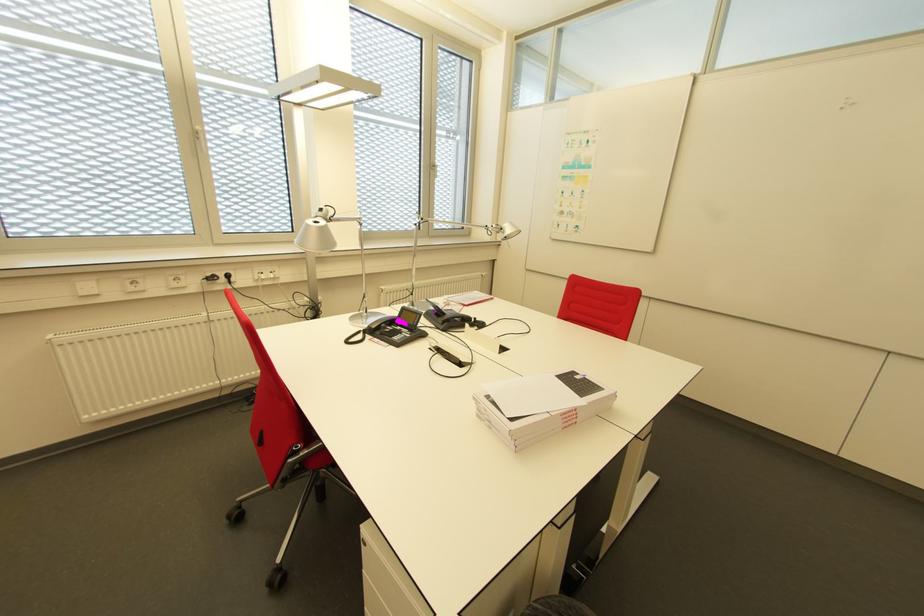
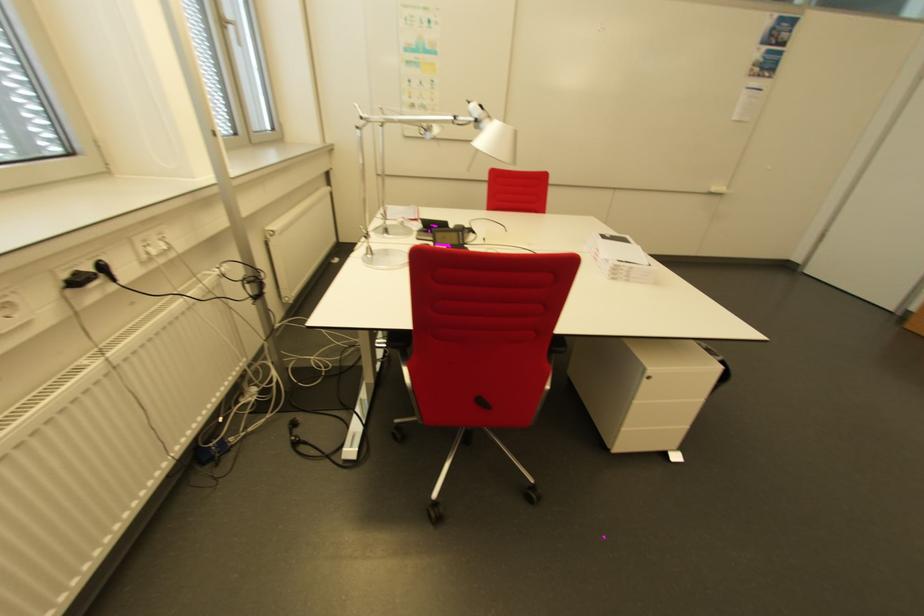
In the second image, find the point that corresponds to pixel 438 169 in the first image.

(235, 31)